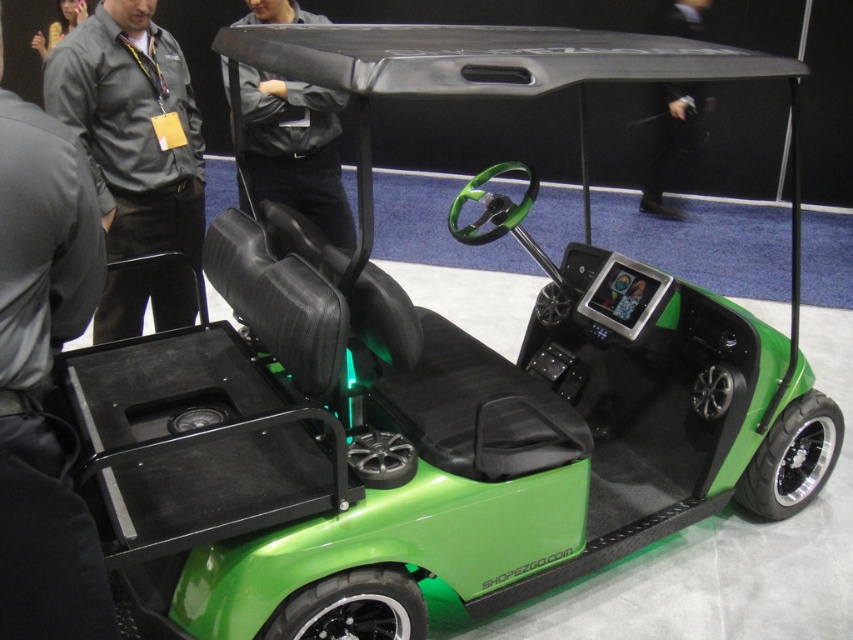
Is gray fabric shirt at upper left smaller than black leather jacket at center?

Yes, gray fabric shirt at upper left is smaller than black leather jacket at center.

Can you confirm if gray fabric shirt at upper left is positioned below black leather jacket at center?

Indeed, gray fabric shirt at upper left is positioned under black leather jacket at center.

Which is behind, point (166, 157) or point (341, 237)?

Point (341, 237)

What are the coordinates of `gray fabric shirt at upper left` in the screenshot? It's located at tap(132, 125).

Is dark gray uniform at left to the right of black leather jacket at upper center from the viewer's perspective?

Incorrect, dark gray uniform at left is not on the right side of black leather jacket at upper center.

Who is positioned more to the left, dark gray uniform at left or black leather jacket at upper center?

From the viewer's perspective, dark gray uniform at left appears more on the left side.

Which is in front, point (10, 132) or point (701, 134)?

Point (10, 132)

The height and width of the screenshot is (640, 853). Identify the location of dark gray uniform at left. (44, 378).

Can you confirm if dark gray uniform at left is positioned above black leather jacket at center?

No.

Is point (97, 237) positioned behind point (297, 106)?

No.

Where is `dark gray uniform at left`? This screenshot has width=853, height=640. dark gray uniform at left is located at coordinates (44, 378).